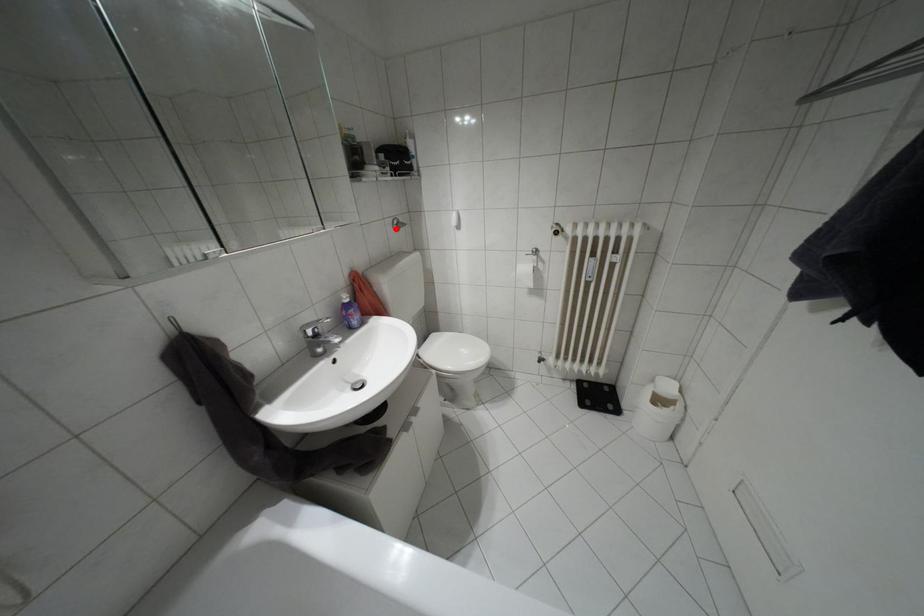
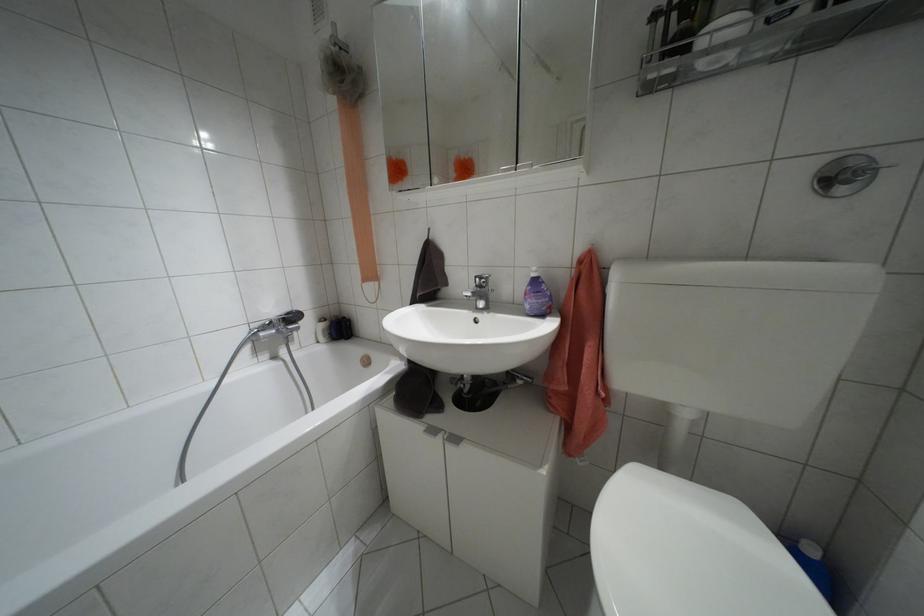
Question: I am providing you with two images of the same scene from different viewpoints. Image1 has a red point marked. In image2, the corresponding 3D location appears at what relative position? Reply with the corresponding letter.

Choices:
 (A) Closer
 (B) Farther

Answer: (B)